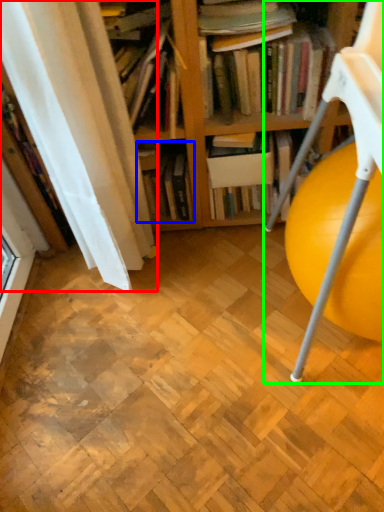
Question: Based on their relative distances, which object is nearer to curtain (highlighted by a red box)? Choose from book (highlighted by a blue box) and rocking chair (highlighted by a green box).

Choices:
 (A) book
 (B) rocking chair

Answer: (A)